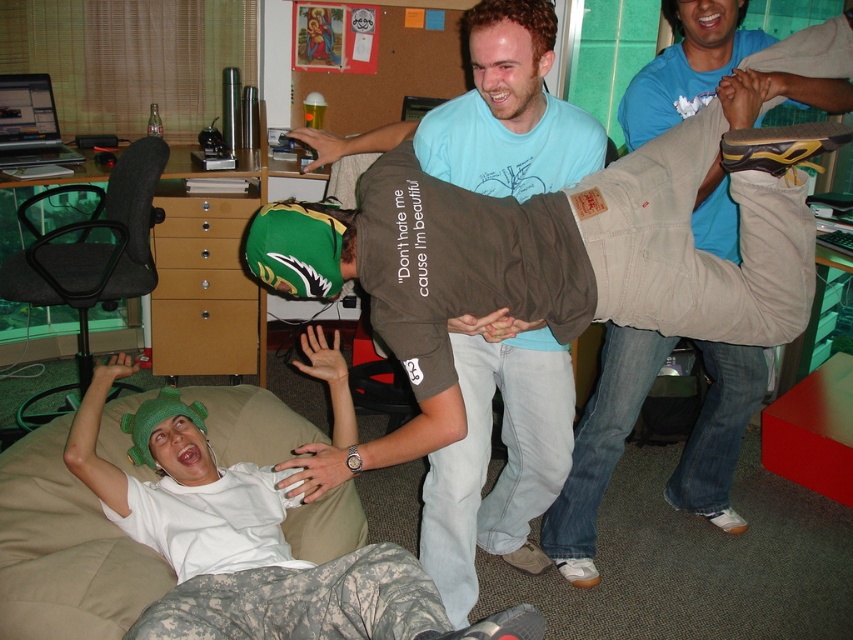
You are a person trying to find a place to sit in the room. You see the beige fabric couch at lower left and the dark gray fabric bean bag chair at left. Which one is closer to the entrance of the room?

The dark gray fabric bean bag chair at left is closer to the entrance because it is positioned to the left of the beige fabric couch at lower left, which is further to the right.

You are a delivery robot with a package that needs to be placed between the khaki cotton pants at center and the beige fabric couch at lower left. The robot requires a minimum of 1 meter of space to maneuver. Can you safely navigate and place the package?

The distance between the khaki cotton pants at center and the beige fabric couch at lower left is 1.11 meters, which is more than the required 1 meter. Therefore, the delivery robot can safely navigate and place the package between them.

You are sitting on the beige fabric couch at lower left and want to reach the dark gray fabric bean bag chair at left. Which direction should you move to get there?

Since the beige fabric couch at lower left is below the dark gray fabric bean bag chair at left, you should move upward to reach the dark gray fabric bean bag chair at left from the beige fabric couch at lower left.